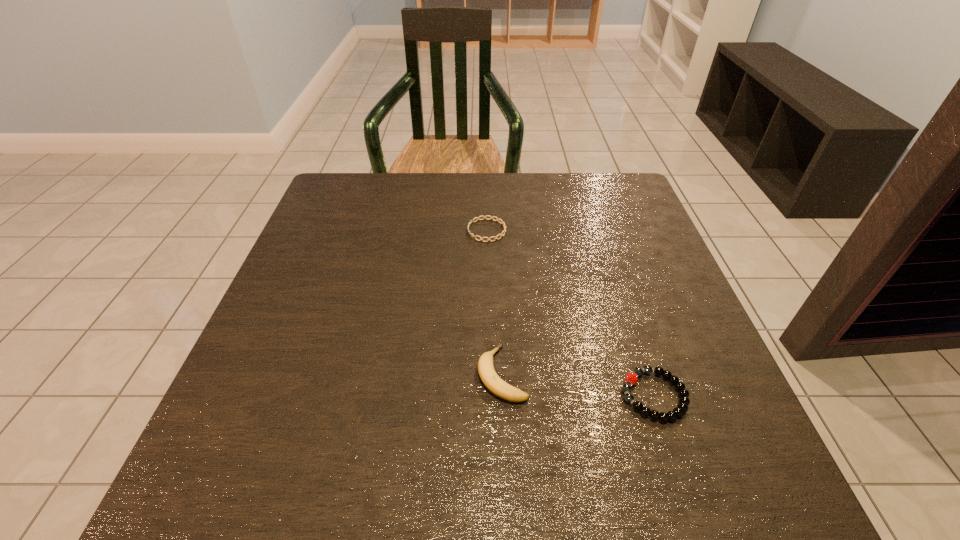
At what (x,y) coordinates should I click in order to perform the action: click on the tallest object. Please return your answer as a coordinate pair (x, y). The image size is (960, 540). Looking at the image, I should click on (489, 377).

This screenshot has width=960, height=540. What are the coordinates of `the second shortest object` in the screenshot? It's located at (684, 401).

Locate an element on the screen. The image size is (960, 540). the rightmost object is located at coordinates (684, 401).

The image size is (960, 540). Find the location of `the shorter bracelet`. the shorter bracelet is located at coordinates (484, 217).

Identify the location of the farther bracelet. (484, 217).

Identify the location of vacant space located on the left of the banana. This screenshot has width=960, height=540. (250, 374).

Locate an element on the screen. vacant space positioned 0.080m on the back of the nearer bracelet is located at coordinates (634, 334).

The height and width of the screenshot is (540, 960). I want to click on vacant region located 0.360m on the surface of the left bracelet showing star-shaped elements, so click(x=320, y=231).

This screenshot has height=540, width=960. I want to click on vacant space located on the surface of the left bracelet showing star-shaped elements, so click(431, 231).

Find the location of a particular element. The width and height of the screenshot is (960, 540). free space located 0.240m on the surface of the left bracelet showing star-shaped elements is located at coordinates (370, 231).